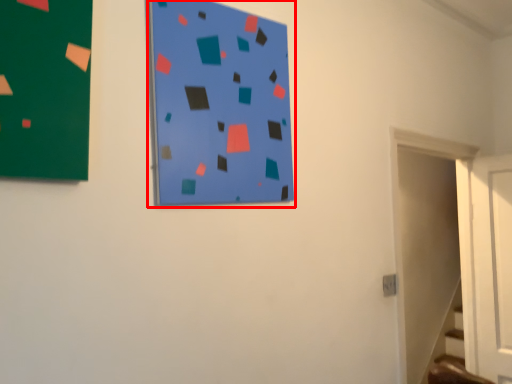
Question: Observing the image, what is the correct spatial positioning of bulletin board (annotated by the red box) in reference to door?

Choices:
 (A) left
 (B) right

Answer: (A)